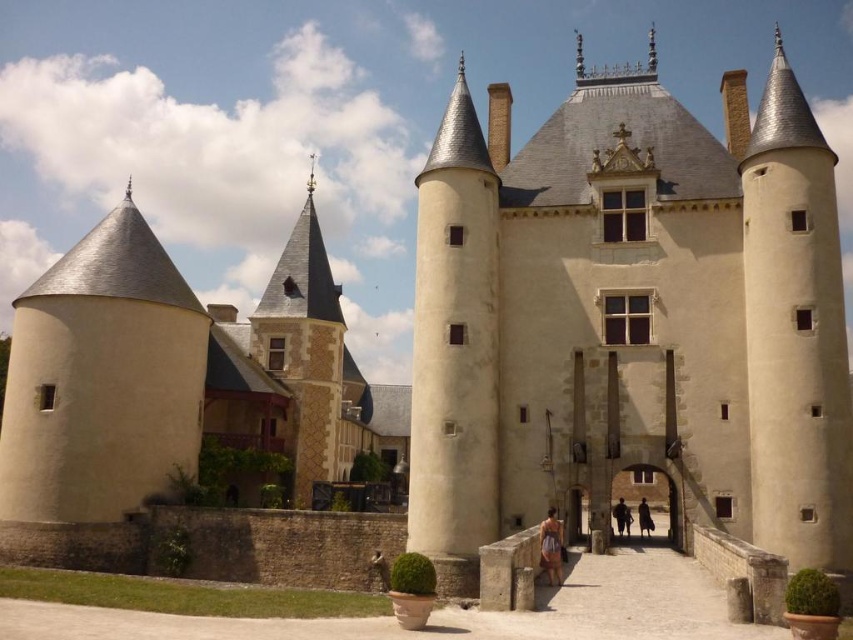
Is point (425, 227) positioned before point (546, 538)?

No.

Measure the distance from beige stone tower at center to light brown fabric dress at center.

beige stone tower at center is 21.44 meters away from light brown fabric dress at center.

This screenshot has height=640, width=853. Identify the location of beige stone tower at center. (631, 317).

At what (x,y) coordinates should I click in order to perform the action: click on beige stone tower at center. Please return your answer as a coordinate pair (x, y). Looking at the image, I should click on (631, 317).

Is light brown fabric dress at center further to camera compared to dark brown leather coat at center?

No, it is not.

You are a GUI agent. You are given a task and a screenshot of the screen. Output one action in this format:
    pyautogui.click(x=<x>, y=<y>)
    Task: Click on the light brown fabric dress at center
    The width and height of the screenshot is (853, 640).
    Given the screenshot: What is the action you would take?
    click(x=550, y=547)

Is beige stone tower at center below dark brown leather jacket at center?

Incorrect, beige stone tower at center is not positioned below dark brown leather jacket at center.

Which is more to the left, beige stone tower at center or dark brown leather jacket at center?

dark brown leather jacket at center is more to the left.

Image resolution: width=853 pixels, height=640 pixels. Describe the element at coordinates (631, 317) in the screenshot. I see `beige stone tower at center` at that location.

Image resolution: width=853 pixels, height=640 pixels. Find the location of `beige stone tower at center`. beige stone tower at center is located at coordinates (631, 317).